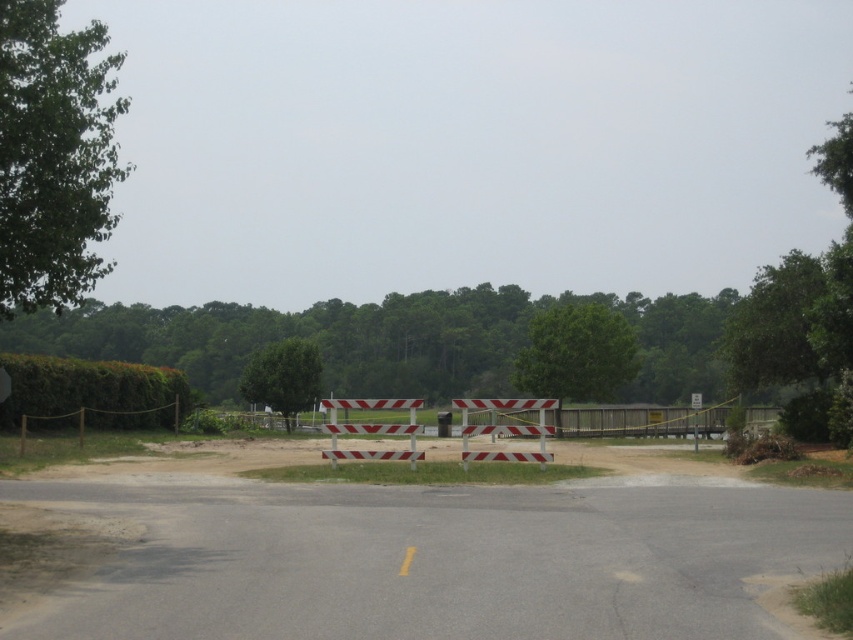
Is white striped plastic barricade at center further to camera compared to reflective plastic barricade at center?

That is False.

Is white striped plastic barricade at center below reflective plastic barricade at center?

Indeed, white striped plastic barricade at center is positioned under reflective plastic barricade at center.

Who is more forward, (373, 456) or (517, 428)?

Point (373, 456) is more forward.

Identify the location of white striped plastic barricade at center. (372, 428).

Is white striped plastic barricade at center wider than white plastic sign at center?

No, white striped plastic barricade at center is not wider than white plastic sign at center.

Can you confirm if white striped plastic barricade at center is shorter than white plastic sign at center?

Yes, white striped plastic barricade at center is shorter than white plastic sign at center.

Does point (335, 432) come behind point (695, 429)?

No, (335, 432) is closer to viewer.

Identify the location of white striped plastic barricade at center. (372, 428).

Identify the location of reflective plastic barricade at center. (505, 428).

The image size is (853, 640). Identify the location of reflective plastic barricade at center. (505, 428).

I want to click on reflective plastic barricade at center, so click(505, 428).